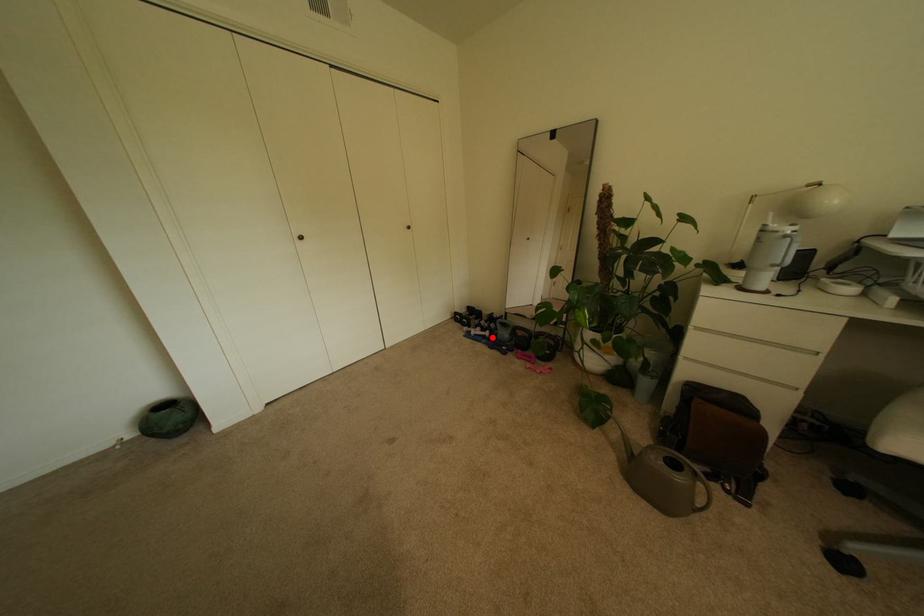
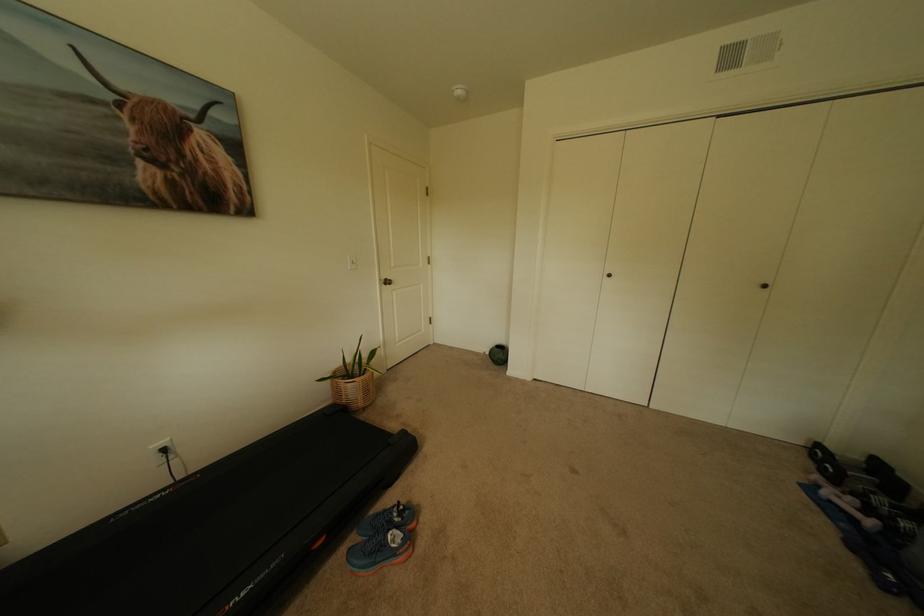
Find the pixel in the second image that matches the highlighted location in the first image.

(862, 521)